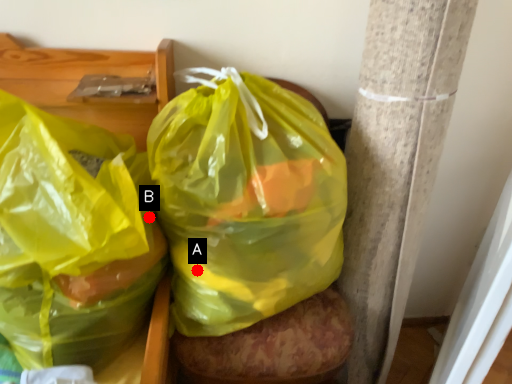
Question: Two points are circled on the image, labeled by A and B beside each circle. Which point appears farthest from the camera in this image?

Choices:
 (A) A is further
 (B) B is further

Answer: (B)